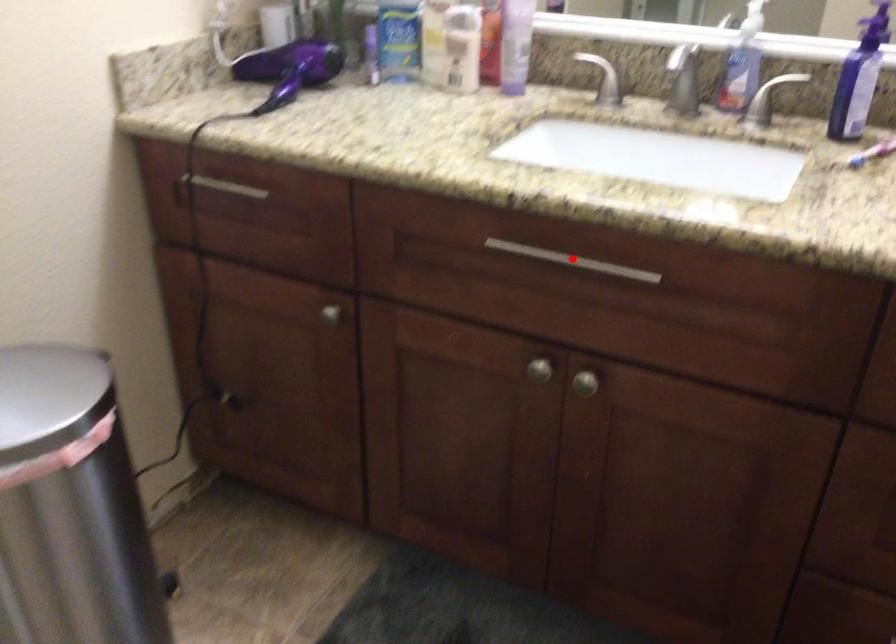
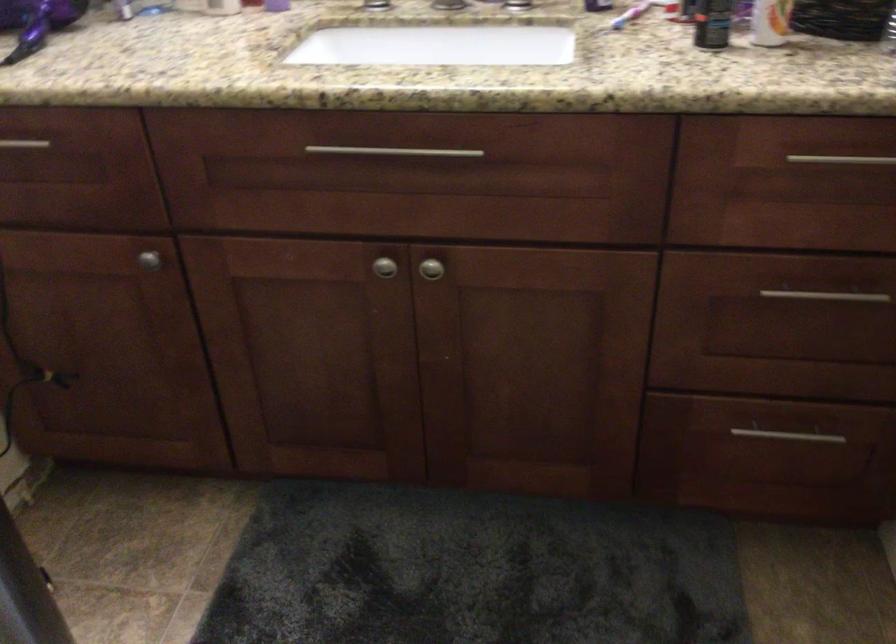
The point at the highlighted location is marked in the first image. Where is the corresponding point in the second image?

(394, 152)